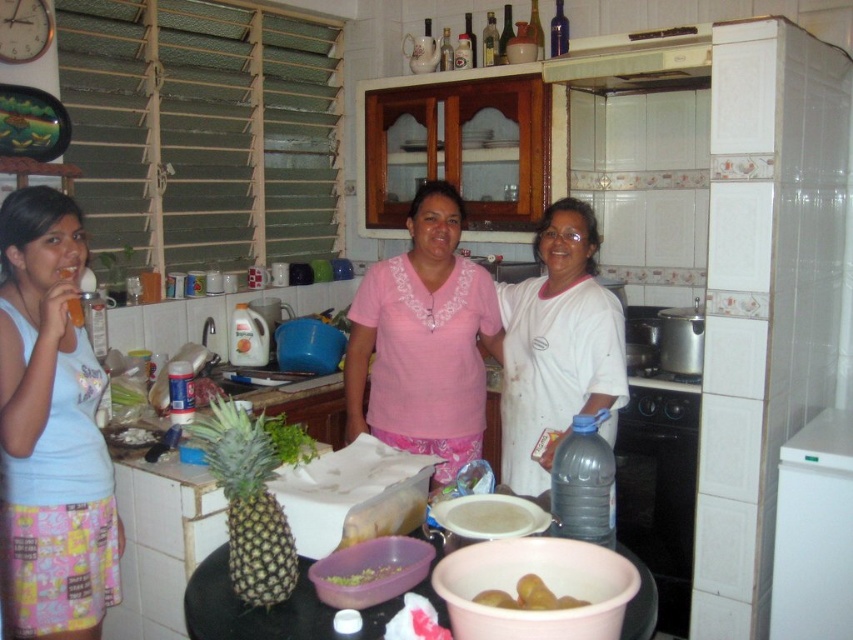
Looking at this image, you are standing in the kitchen and want to reach both the point at coordinates (393, 400) and the point at coordinates (383, 577). Which point will you reach first?

You will reach point (393, 400) first because it is closer to you than point (383, 577), which is further away.

You are a chef preparing a fruit salad and need to place the white cotton shirt at center and the yellow matte kiwi at lower center on the table. According to the scene, which object is located to the right of the other?

The white cotton shirt at center is positioned on the right side of yellow matte kiwi at lower center.